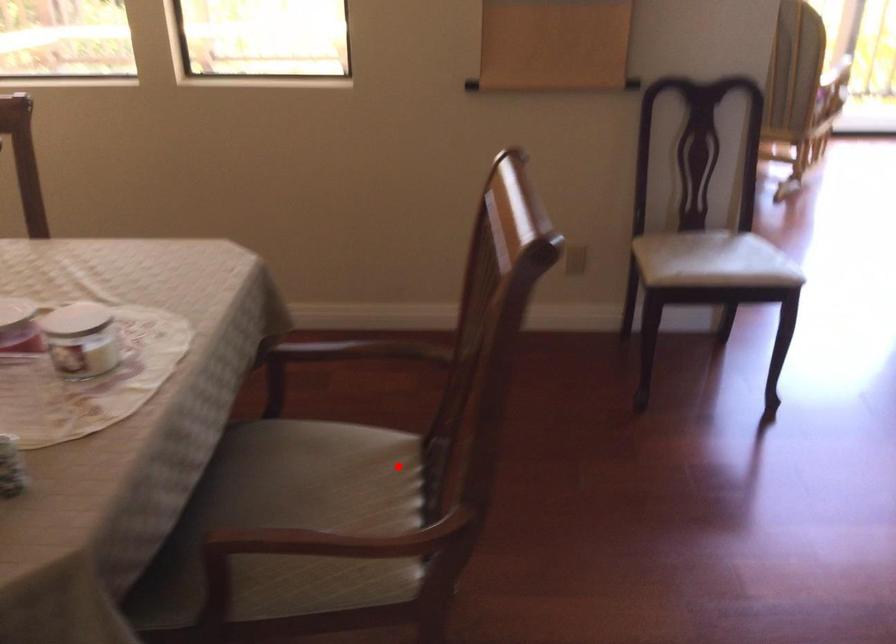
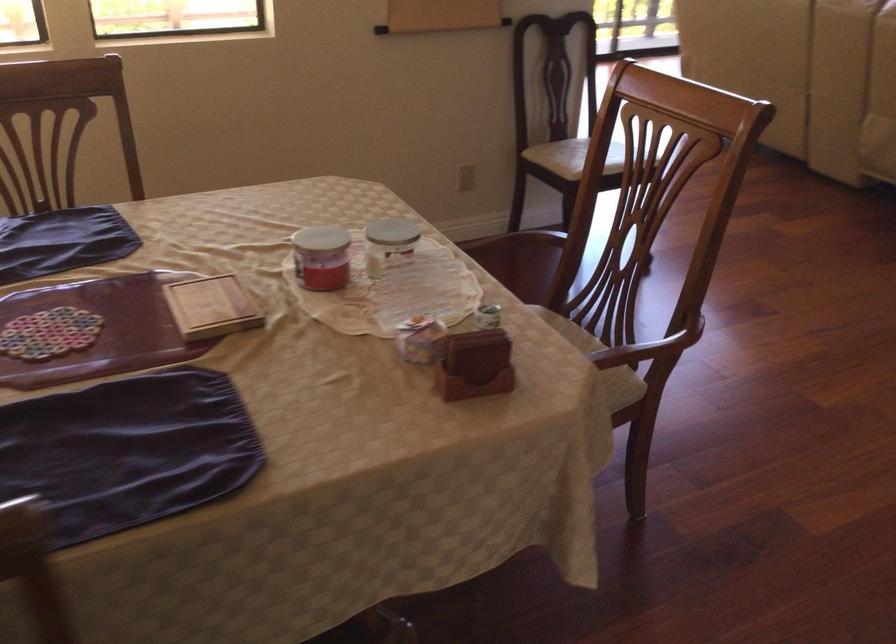
Where in the second image is the point corresponding to the highlighted location from the first image?

(564, 322)